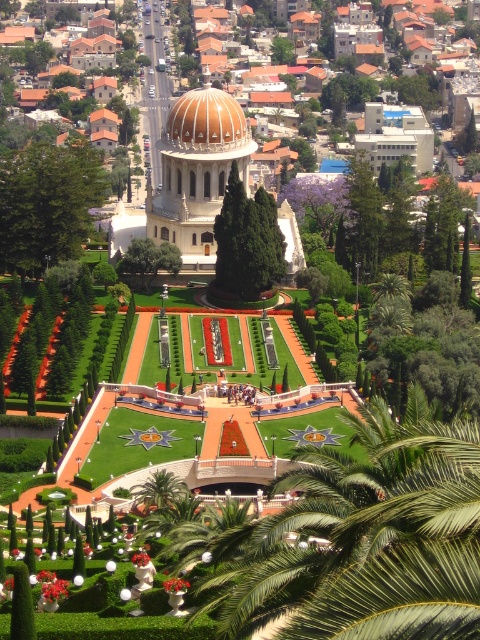
Question: Is green leafy palm tree at center to the right of matte gold dome at center from the viewer's perspective?

Choices:
 (A) no
 (B) yes

Answer: (B)

Question: Which object is the closest to the green leafy palm tree at lower center?

Choices:
 (A) green leafy palm tree at center
 (B) matte gold dome at center

Answer: (A)

Question: Is the position of green leafy palm tree at center more distant than that of green leafy palm tree at lower center?

Choices:
 (A) yes
 (B) no

Answer: (B)

Question: Can you confirm if green leafy palm tree at center is positioned to the right of matte gold dome at center?

Choices:
 (A) no
 (B) yes

Answer: (B)

Question: Which of the following is the farthest from the observer?

Choices:
 (A) (396, 588)
 (B) (191, 124)
 (C) (164, 476)

Answer: (B)

Question: Which object appears closest to the camera in this image?

Choices:
 (A) matte gold dome at center
 (B) green leafy palm tree at lower center

Answer: (B)